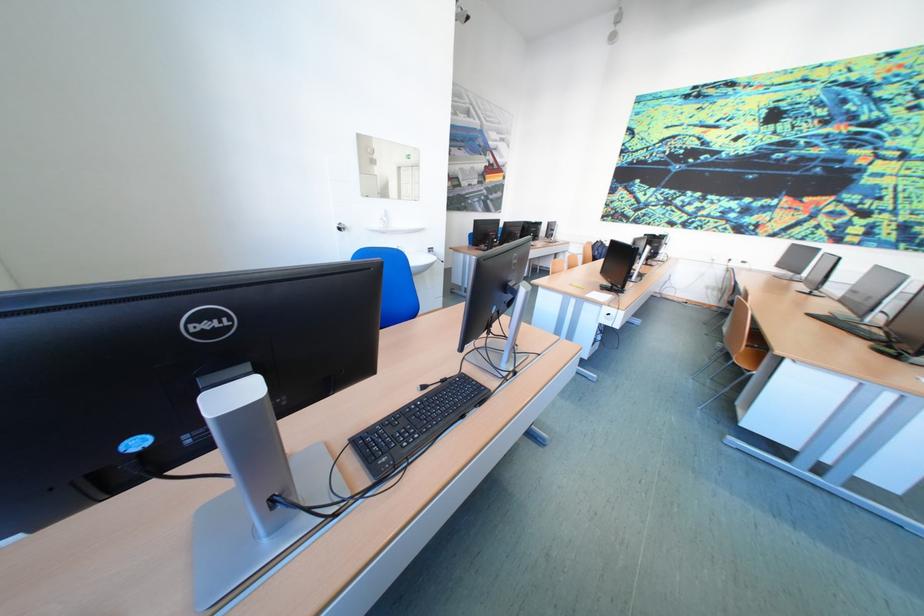
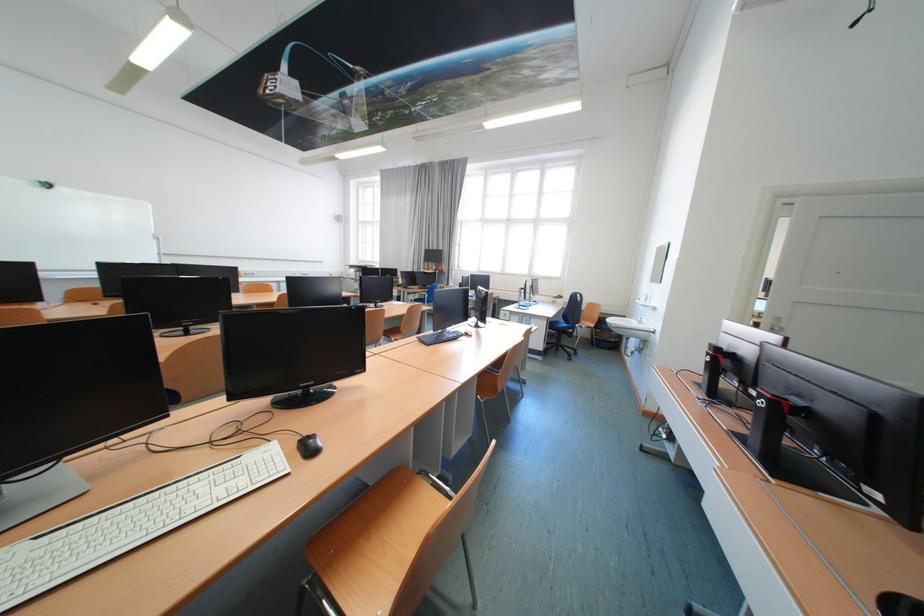
Question: I am providing you with two images of the same scene from different viewpoints. Which of the following objects are not visible in image2?

Choices:
 (A) black computer mouse
 (B) black keyboard
 (C) wooden chair sitting surface
 (D) wall painting

Answer: (B)